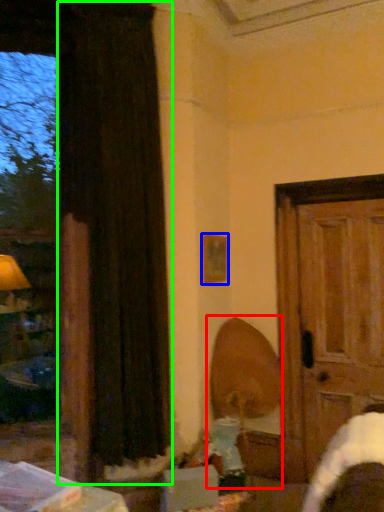
Question: Which is farther away from swivel chair (highlighted by a red box)? picture frame (highlighted by a blue box) or curtain (highlighted by a green box)?

Choices:
 (A) picture frame
 (B) curtain

Answer: (B)